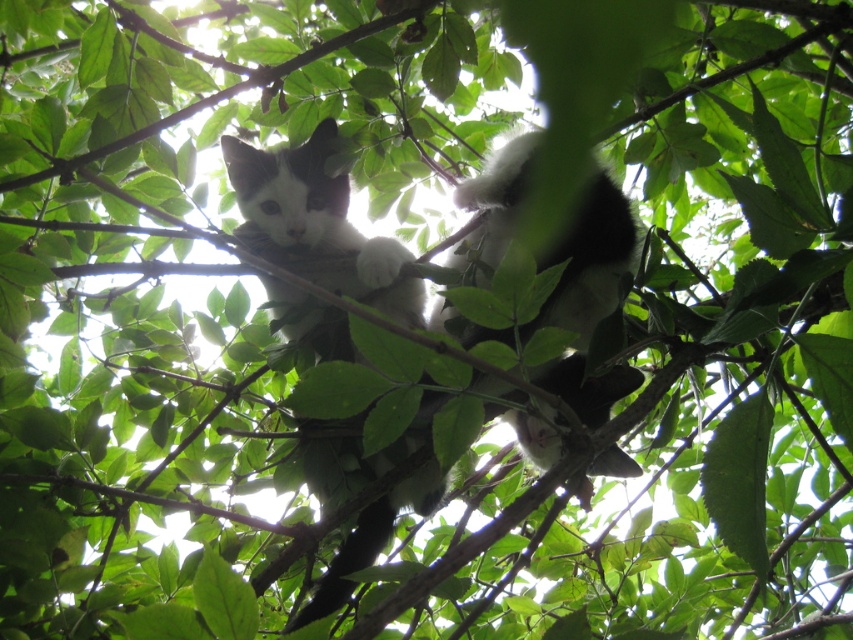
You are a photographer trying to capture both cats in a single shot. Given that the black and white fur cat at center is partially hidden by leaves, will the white fluffy cat at center be more visible in your photo?

The black and white fur cat at center is closer to the viewer than the white fluffy cat at center, so the white fluffy cat at center will be less visible due to being further back and possibly obscured by the foliage in front of it.

You are a photographer trying to capture both the black and white fur cat at center and the white fluffy cat at center in a single shot. Which cat will appear smaller in the photo?

The black and white fur cat at center will appear smaller in the photo because it has a lesser height compared to the white fluffy cat at center.

You are a photographer trying to capture both the black and white fur cat at center and the white fluffy cat at center in a single shot. Which cat should you focus on first to ensure both are in frame?

The black and white fur cat at center is positioned under the white fluffy cat at center, so you should focus on the white fluffy cat at center first to ensure both are in frame.